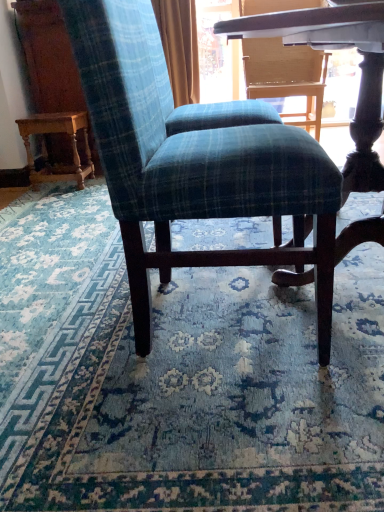
Question: From a real-world perspective, is blue plaid fabric at center physically located above or below wooden carved table at left?

Choices:
 (A) below
 (B) above

Answer: (A)

Question: Considering the positions of blue plaid fabric at center and wooden carved table at left in the image, is blue plaid fabric at center wider or thinner than wooden carved table at left?

Choices:
 (A) wide
 (B) thin

Answer: (A)

Question: Which object is the closest to the blue plaid fabric at center?

Choices:
 (A) wooden carved table at left
 (B) plaid fabric chair at center

Answer: (B)

Question: Based on their relative distances, which object is nearer to the plaid fabric chair at center?

Choices:
 (A) blue plaid fabric at center
 (B) wooden carved table at left

Answer: (A)